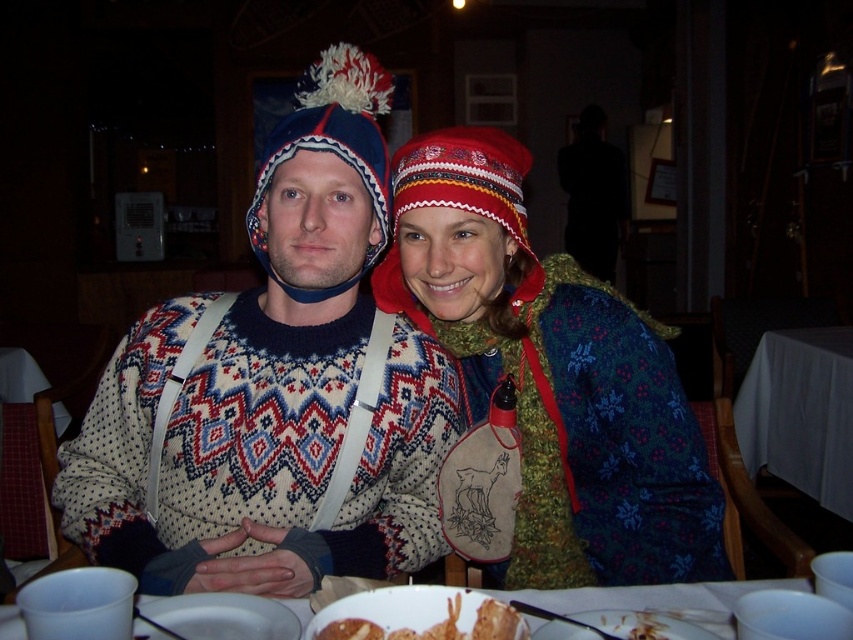
Question: Which point is closer to the camera taking this photo?

Choices:
 (A) (138, 438)
 (B) (838, 369)
 (C) (466, 604)

Answer: (C)

Question: Does knitted sweater at center appear over white plastic cups at lower center?

Choices:
 (A) yes
 (B) no

Answer: (A)

Question: Which point is closer to the camera?

Choices:
 (A) knitted woolen hat at center
 (B) knitted wool sweater at center

Answer: (A)

Question: Does knitted wool sweater at center appear under white ceramic plate at lower center?

Choices:
 (A) no
 (B) yes

Answer: (A)

Question: Which object is the closest to the white plastic cups at lower center?

Choices:
 (A) white cloth table at center
 (B) knitted woolen hat at center

Answer: (B)

Question: Can you confirm if white cloth table at center is wider than knitted woolen hat at center?

Choices:
 (A) yes
 (B) no

Answer: (A)